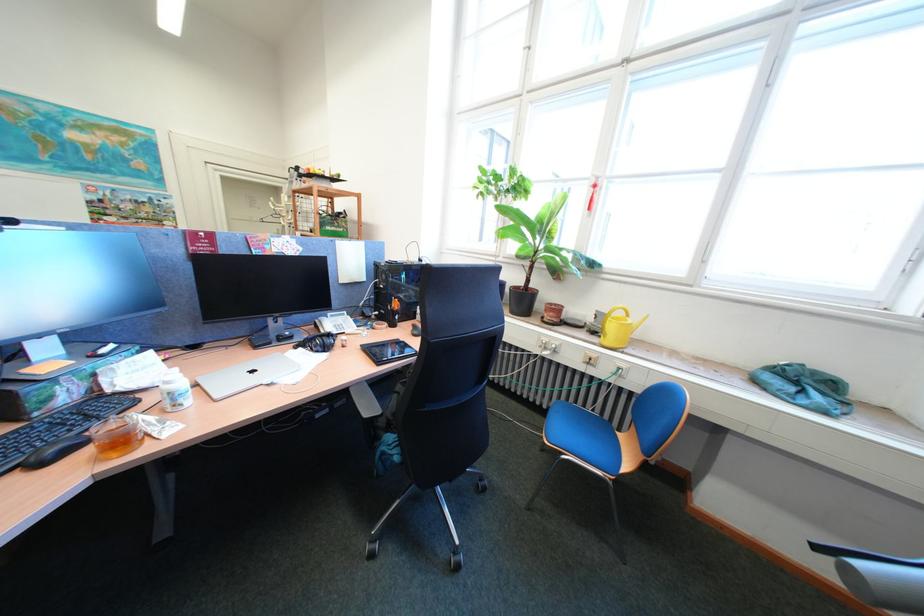
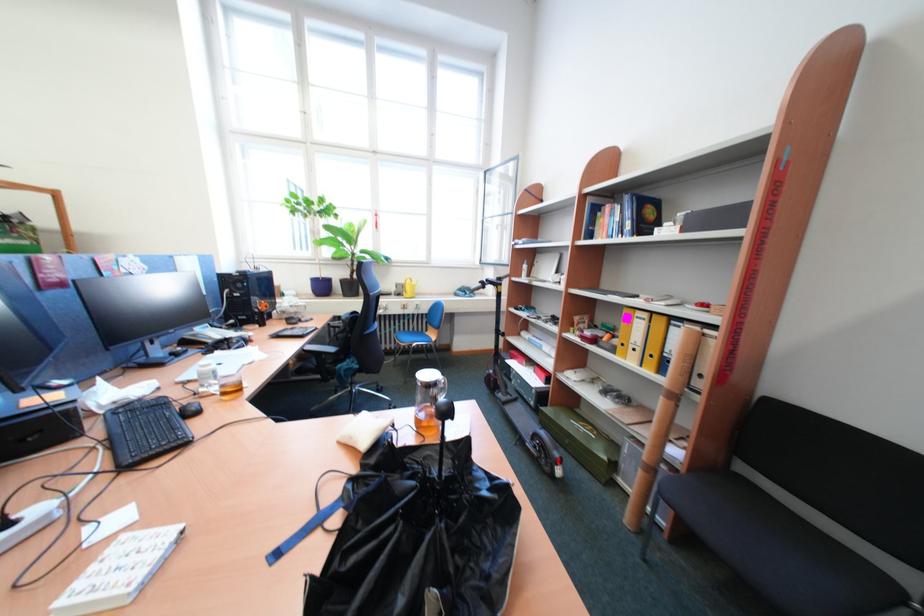
In the second image, find the point that corresponds to point 594,329 in the first image.

(403, 296)